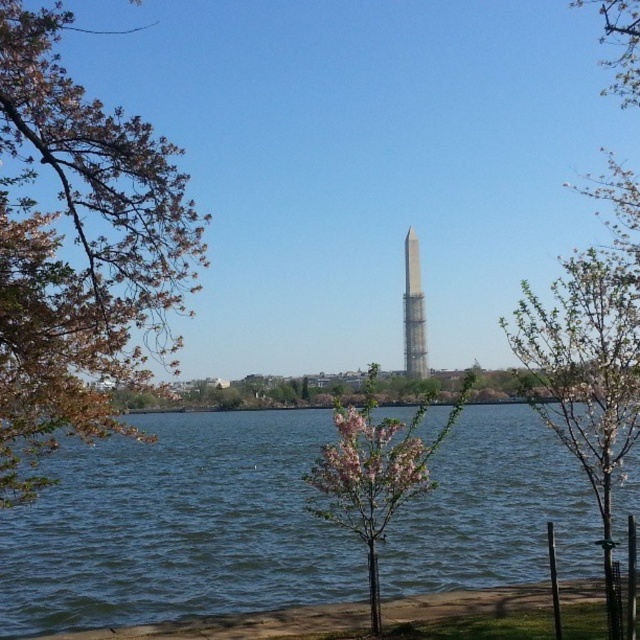
In order to click on pink blossoming tree at center in this screenshot , I will do `click(374, 472)`.

Between pink blossoming tree at center and silver metallic tower at center, which one has less height?

silver metallic tower at center

Is point (369, 509) closer to viewer compared to point (419, 333)?

Yes, point (369, 509) is closer to viewer.

You are a GUI agent. You are given a task and a screenshot of the screen. Output one action in this format:
    pyautogui.click(x=<x>, y=<y>)
    Task: Click on the pink blossoming tree at center
    
    Given the screenshot: What is the action you would take?
    pyautogui.click(x=374, y=472)

Is blue water at center smaller than brown leafy tree at left?

Yes, blue water at center is smaller than brown leafy tree at left.

Which is above, blue water at center or brown leafy tree at left?

brown leafy tree at left is higher up.

Describe the element at coordinates (177, 528) in the screenshot. The image size is (640, 640). I see `blue water at center` at that location.

Locate an element on the screen. Image resolution: width=640 pixels, height=640 pixels. blue water at center is located at coordinates (177, 528).

The image size is (640, 640). What do you see at coordinates (177, 528) in the screenshot? I see `blue water at center` at bounding box center [177, 528].

Which is in front, point (413, 580) or point (608, 497)?

Point (608, 497)

I want to click on blue water at center, so click(x=177, y=528).